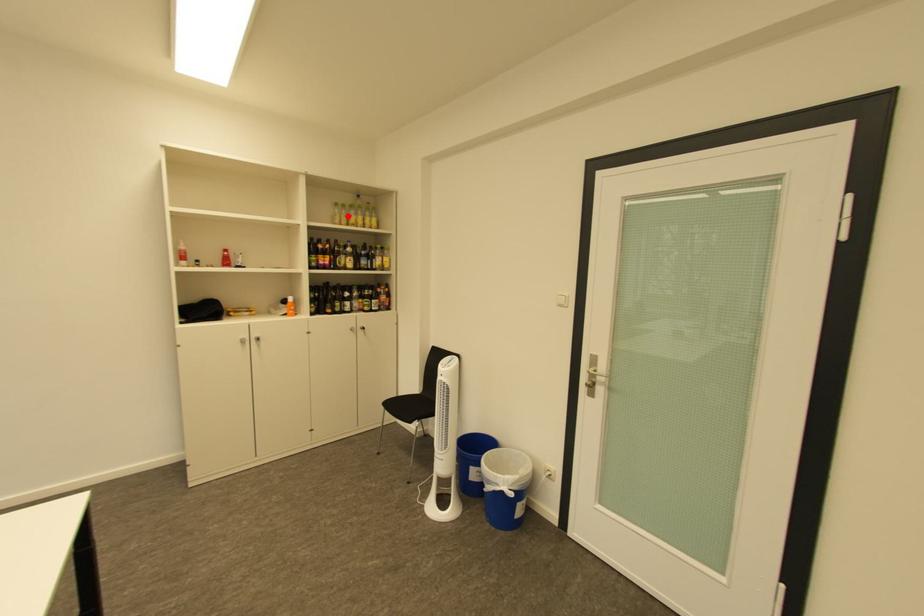
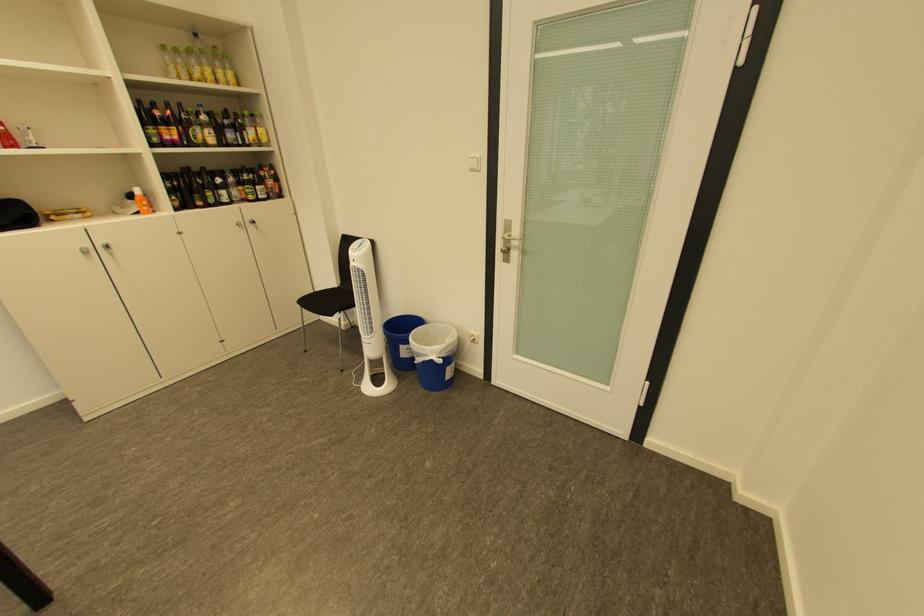
Question: I am providing you with two images of the same scene from different viewpoints. A red point is shown in image1. For the corresponding object point in image2, is it positioned nearer or farther from the camera?

Choices:
 (A) Nearer
 (B) Farther

Answer: (B)